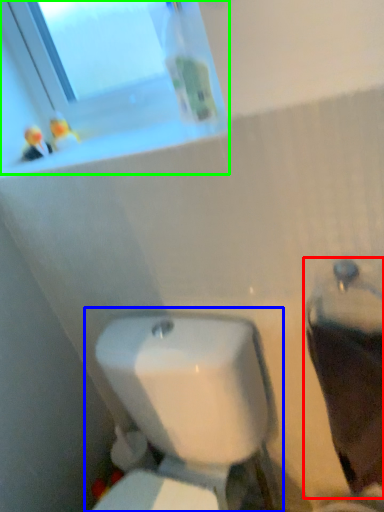
Question: Based on their relative distances, which object is farther from porcelain (highlighted by a red box)? Choose from toilet (highlighted by a blue box) and window (highlighted by a green box).

Choices:
 (A) toilet
 (B) window

Answer: (B)